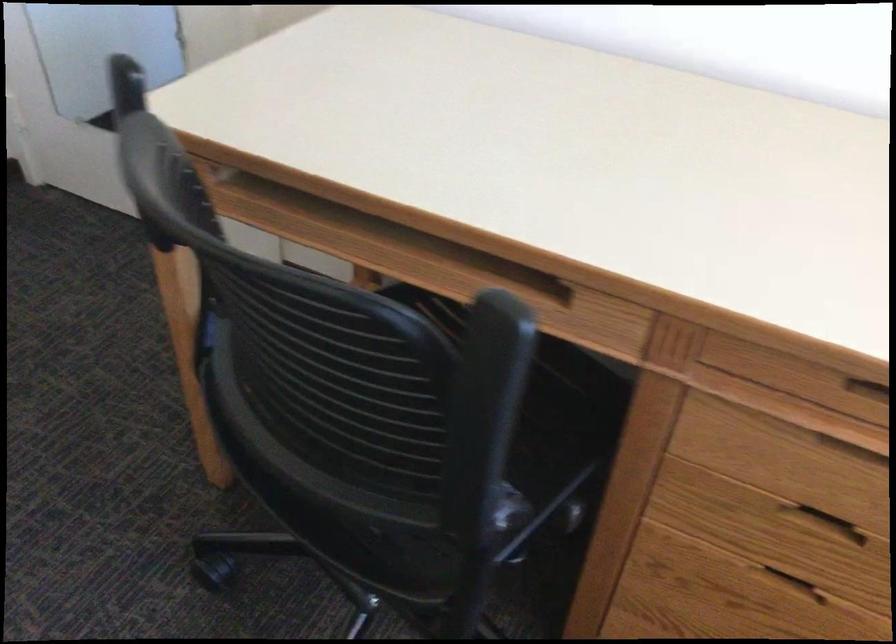
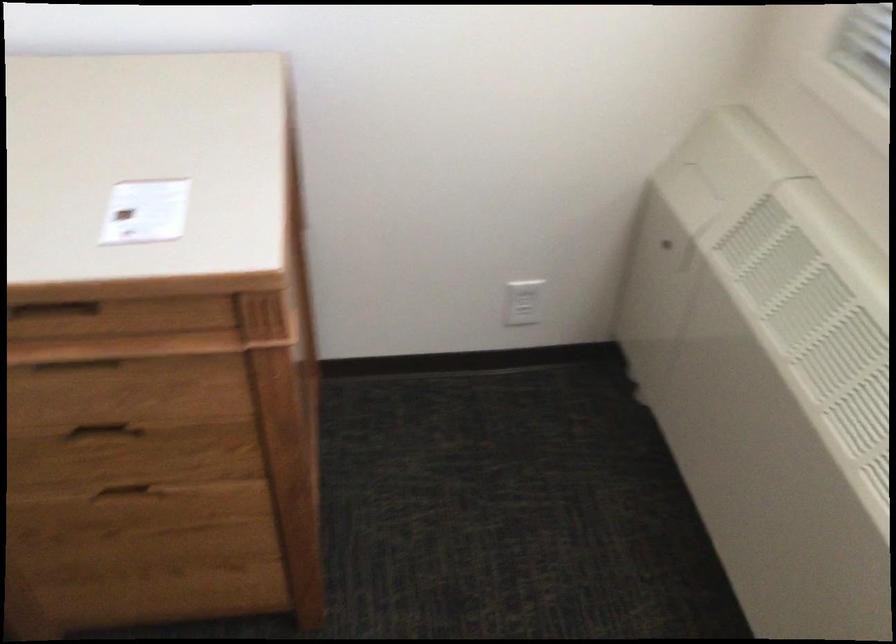
Where in the second image is the point corresponding to (x=814, y=509) from the first image?

(106, 431)